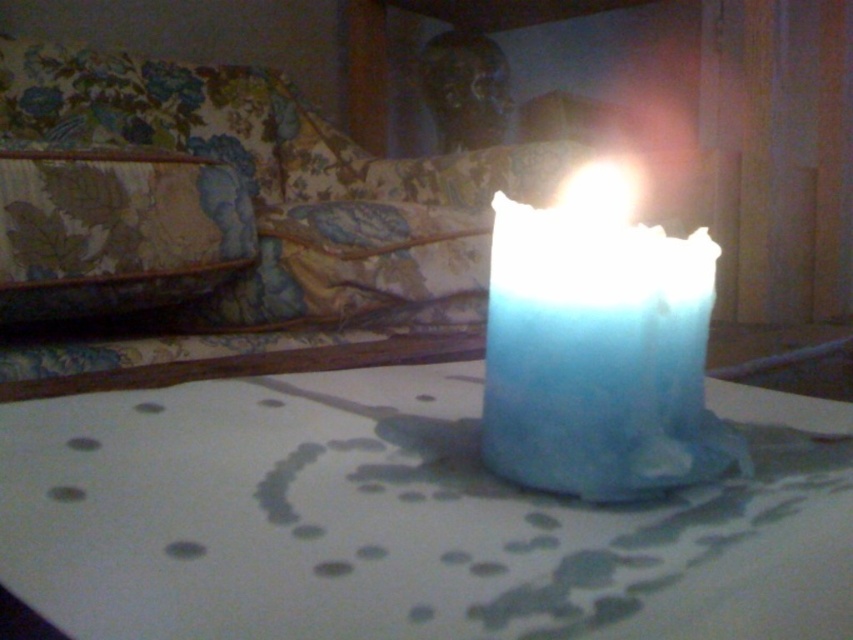
Question: Which point is farther to the camera?

Choices:
 (A) translucent glass candle at center
 (B) blue wax candle at center

Answer: (B)

Question: Which of the following is the closest to the observer?

Choices:
 (A) (634, 528)
 (B) (651, 380)

Answer: (A)

Question: Does translucent glass candle at center appear on the right side of blue wax candle at center?

Choices:
 (A) yes
 (B) no

Answer: (B)

Question: Does translucent glass candle at center have a lesser width compared to blue wax candle at center?

Choices:
 (A) yes
 (B) no

Answer: (B)

Question: Does translucent glass candle at center lie behind blue wax candle at center?

Choices:
 (A) yes
 (B) no

Answer: (B)